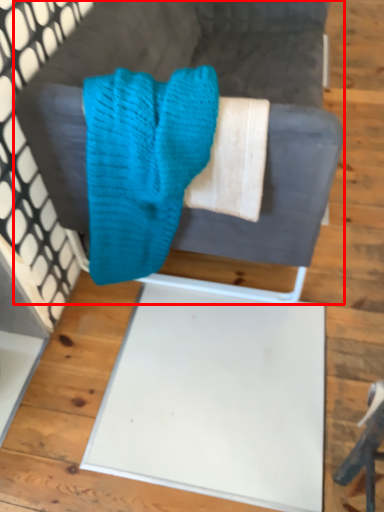
Question: From the image's perspective, what is the correct spatial positioning of furniture (annotated by the red box) in reference to scrub?

Choices:
 (A) above
 (B) below

Answer: (A)